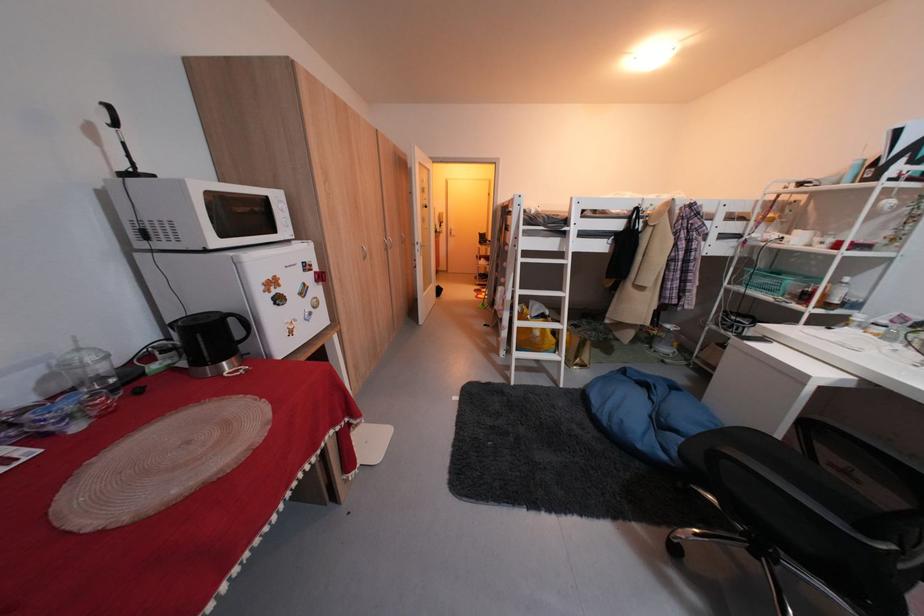
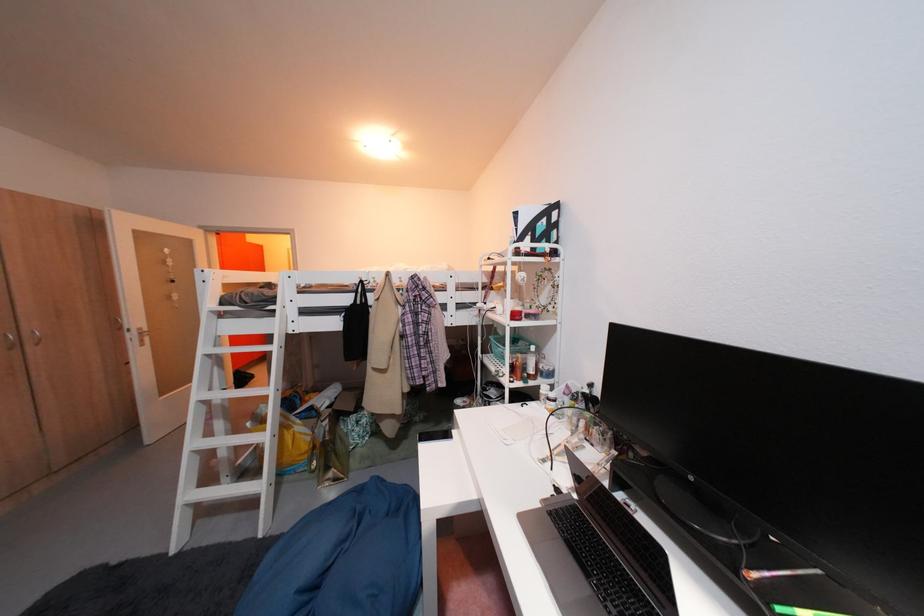
In the second image, find the point that corresponds to (555,347) in the first image.

(296, 461)